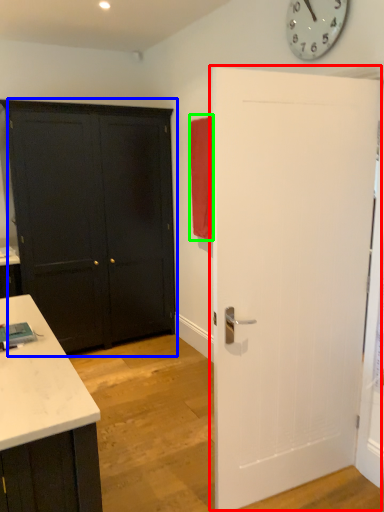
Question: Which object is the farthest from door (highlighted by a red box)? Choose among these: door (highlighted by a blue box) or curtain (highlighted by a green box).

Choices:
 (A) door
 (B) curtain

Answer: (A)